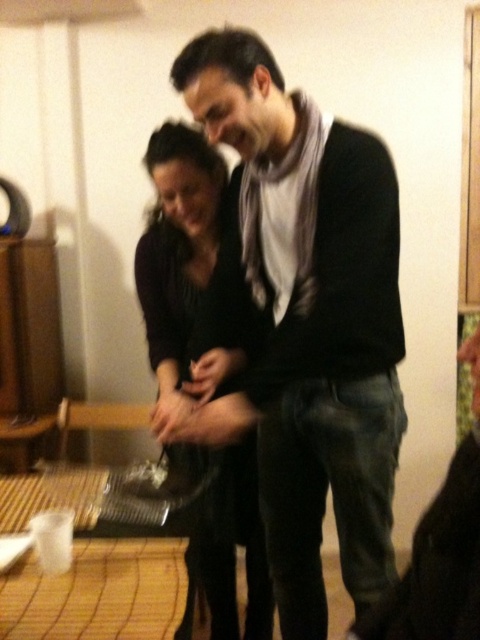
Question: Does black matte scarf at center appear under black matte dress at center?

Choices:
 (A) no
 (B) yes

Answer: (B)

Question: Which point is farther to the camera?

Choices:
 (A) black matte scarf at center
 (B) black matte dress at center

Answer: (B)

Question: Among these objects, which one is farthest from the camera?

Choices:
 (A) black matte scarf at center
 (B) black matte dress at center

Answer: (B)

Question: Is black matte scarf at center positioned behind black matte dress at center?

Choices:
 (A) no
 (B) yes

Answer: (A)

Question: Where is black matte scarf at center located in relation to black matte dress at center in the image?

Choices:
 (A) below
 (B) above

Answer: (A)